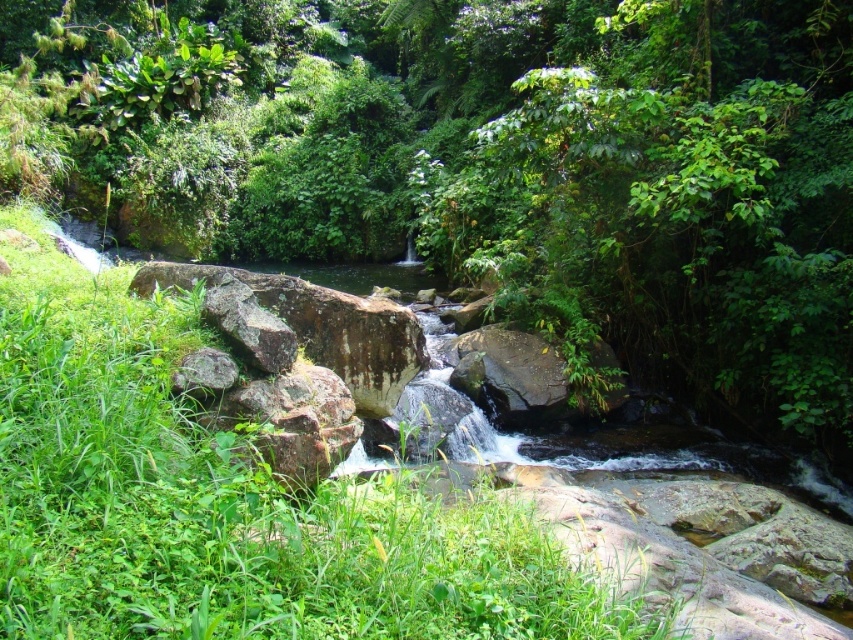
You are a hiker standing at the edge of the stream in the scene. You need to determine which object, the green leafy tree at center or the green grass at lower left, is taller. Based on the scene, which one is taller?

The green leafy tree at center is taller than the green grass at lower left.